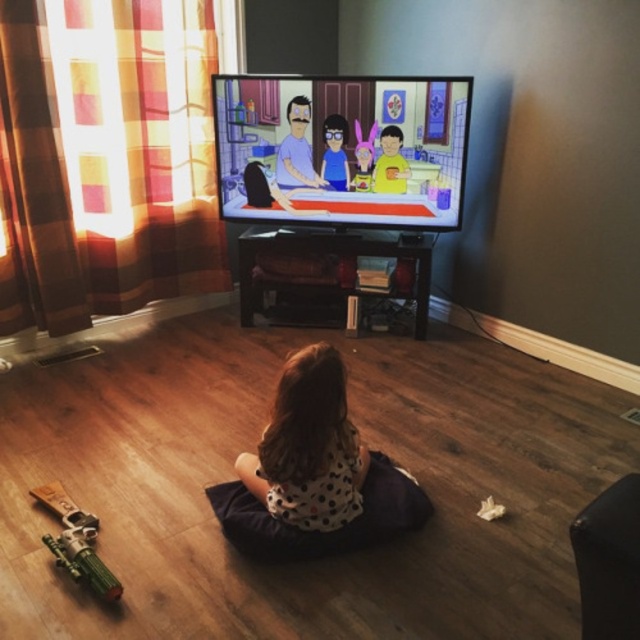
Question: Which of the following is the farthest from the observer?

Choices:
 (A) white dotted fabric at center
 (B) green plastic toy gun at lower left

Answer: (A)

Question: Is polka dot fabric at center thinner than white dotted fabric at center?

Choices:
 (A) no
 (B) yes

Answer: (B)

Question: Which object appears farthest from the camera in this image?

Choices:
 (A) green plastic toy gun at lower left
 (B) cartoon characters at upper center
 (C) polka dot fabric at center

Answer: (B)

Question: Is polka dot fabric at center to the right of green plastic toy gun at lower left from the viewer's perspective?

Choices:
 (A) no
 (B) yes

Answer: (B)

Question: Among these points, which one is farthest from the camera?

Choices:
 (A) (339, 490)
 (B) (435, 205)
 (C) (65, 536)
 (D) (406, 484)

Answer: (B)

Question: Observing the image, what is the correct spatial positioning of cartoon characters at upper center in reference to polka dot fabric at center?

Choices:
 (A) left
 (B) right

Answer: (B)